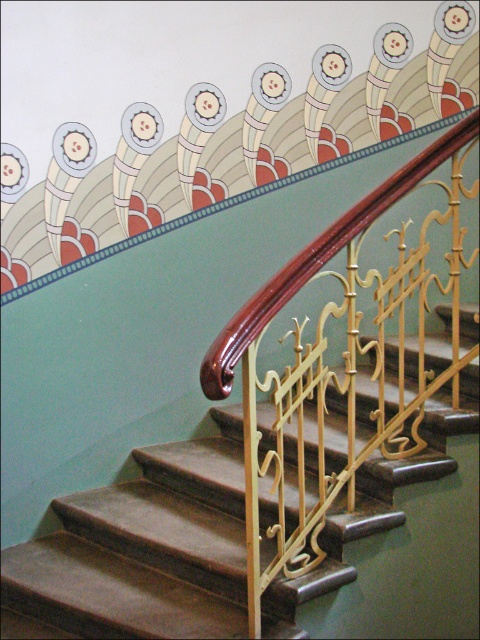
You are standing at the bottom of the staircase and want to reach the top. The brown leather stairs at center is represented by point (142, 550). Can you determine the direction you should move to ascend the stairs?

The brown leather stairs at center is represented by point (142, 550). Since the stairs are at the center, you should move towards the center direction to ascend the stairs.

You are an interior designer assessing the staircase in the image. You need to determine if the glossy wood handrail at upper center can be replaced with a wider version without affecting the brown leather stairs at center. Based on their sizes, what would you advise?

The brown leather stairs at center has a larger size compared to the glossy wood handrail at upper center. Therefore, replacing the glossy wood handrail at upper center with a wider version might not significantly impact the brown leather stairs at center since the stairs are already larger in size.

You are a painter holding a 3.5 feet wide painting. You want to hang it between the brown leather stairs at center and the glossy wood handrail at upper center. Can the painting fit in the space between them?

The distance between the brown leather stairs at center and the glossy wood handrail at upper center is 3.31 feet. Since the painting is 3.5 feet wide, it is slightly wider than the available space. Therefore, the painting cannot fit between them.